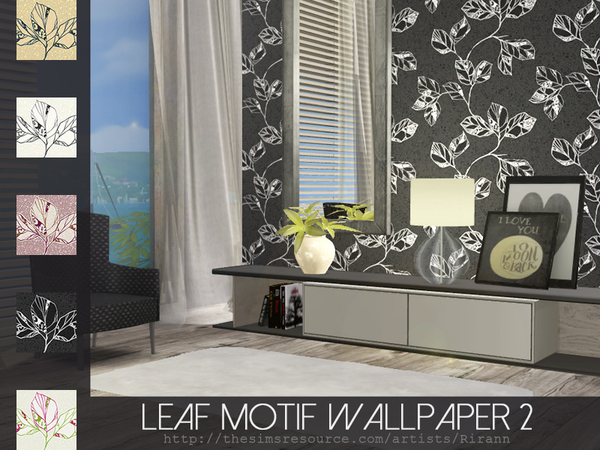
Identify the location of lamp. (456, 266).